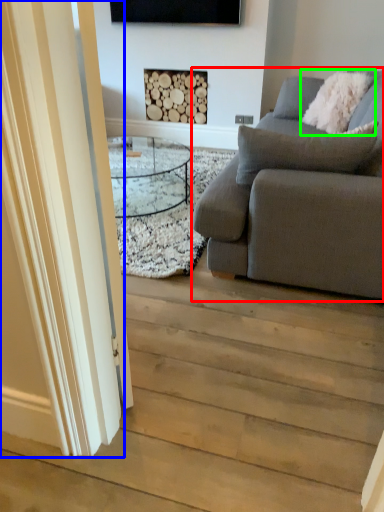
Question: Which is farther away from studio couch (highlighted by a red box)? glass door (highlighted by a blue box) or pillow (highlighted by a green box)?

Choices:
 (A) glass door
 (B) pillow

Answer: (B)